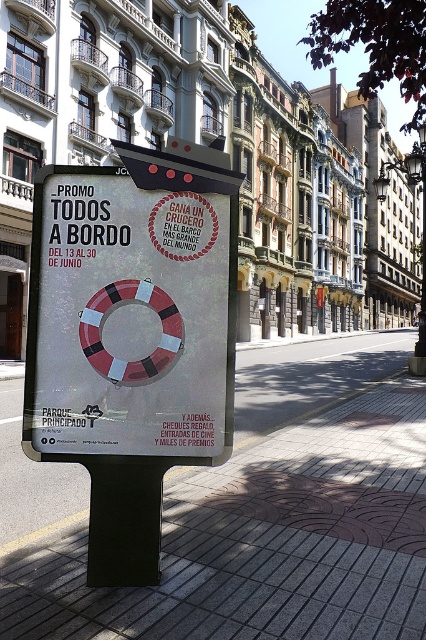
Is point (328, 419) more distant than point (143, 355)?

Yes, point (328, 419) is farther from viewer.

This screenshot has height=640, width=426. What do you see at coordinates (250, 515) in the screenshot? I see `brick pavement at center` at bounding box center [250, 515].

Is point (377, 403) farther from camera compared to point (74, 198)?

Yes.

This screenshot has height=640, width=426. In order to click on brick pavement at center in this screenshot , I will do tap(250, 515).